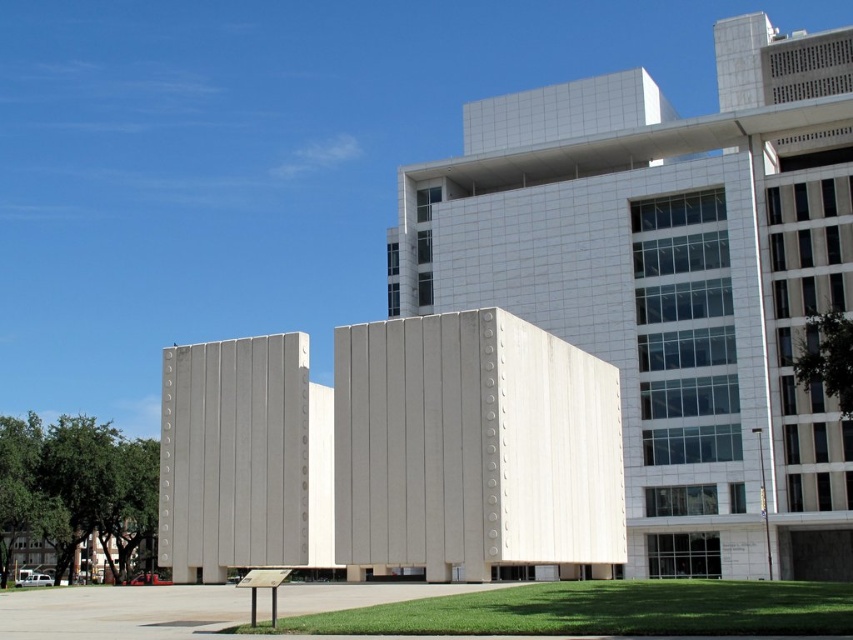
Between point (177, 438) and point (593, 440), which one is positioned in front?

Point (177, 438)

From the picture: Is smooth concrete building at center further to the viewer compared to white concrete building at center?

That is False.

This screenshot has width=853, height=640. What do you see at coordinates (671, 282) in the screenshot? I see `smooth concrete building at center` at bounding box center [671, 282].

You are a GUI agent. You are given a task and a screenshot of the screen. Output one action in this format:
    pyautogui.click(x=<x>, y=<y>)
    Task: Click on the smooth concrete building at center
    This screenshot has width=853, height=640.
    Given the screenshot: What is the action you would take?
    pyautogui.click(x=671, y=282)